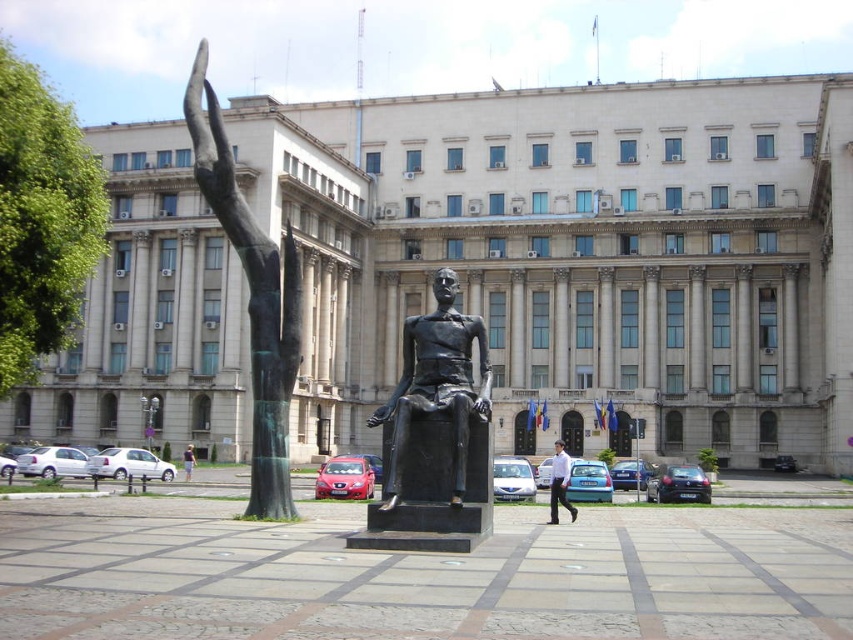
You are a delivery person needing to place a package between the bronze statue at left and the light brown hair at lower left. The package requires a minimum of 80 feet of space between them to fit. Can you place the package there?

The bronze statue at left and light brown hair at lower left are 80.98 feet apart from each other. Since 80.98 feet is just over the required 80 feet, the package can be placed between them with sufficient space.

You are standing in front of the large, imposing building with classical architectural features. You notice a point at coordinates (x=436, y=385). What object is located at that point?

The bronze statue at center is located at point (x=436, y=385).